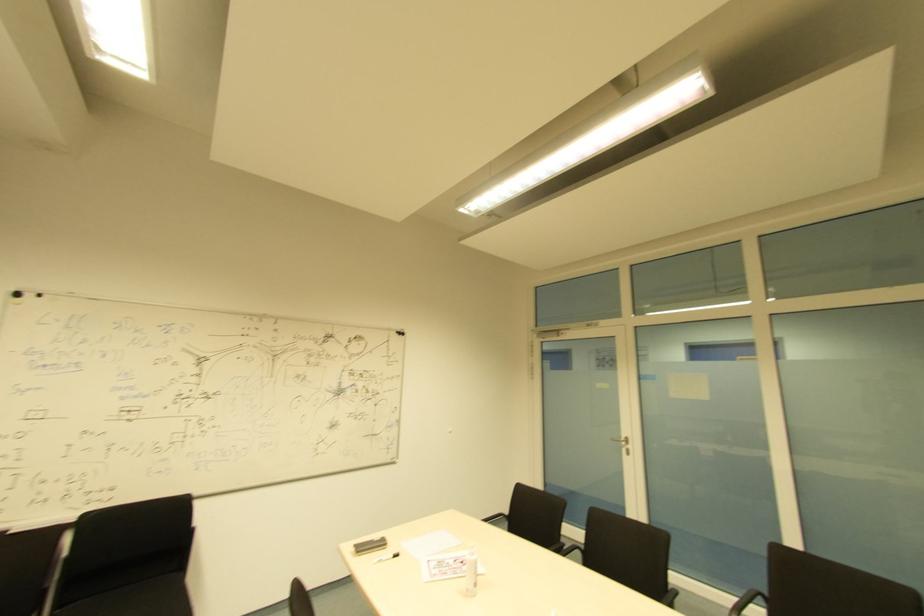
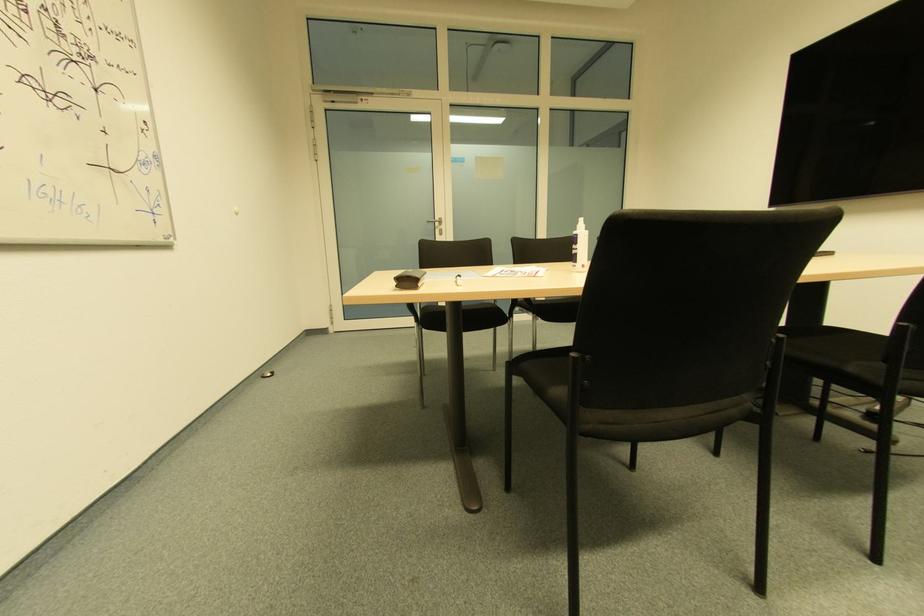
The point at (628, 450) is marked in the first image. Where is the corresponding point in the second image?

(440, 230)